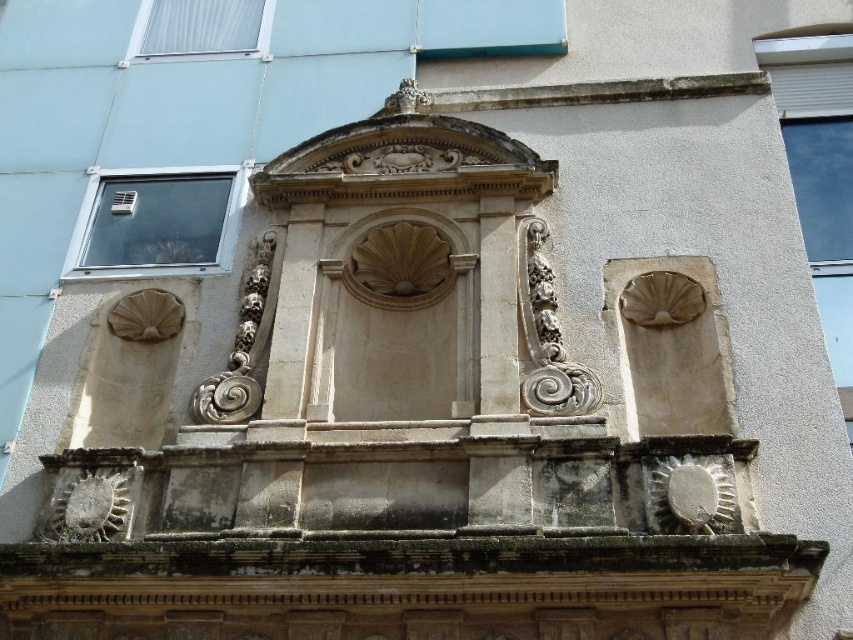
Which is behind, point (117, 184) or point (202, 1)?

The point (202, 1) is more distant.

The height and width of the screenshot is (640, 853). Identify the location of transparent glass window at upper left. (155, 221).